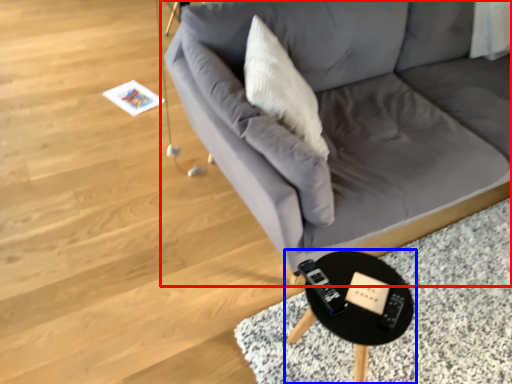
Question: Which object appears closest to the camera in this image, studio couch (highlighted by a red box) or table (highlighted by a blue box)?

Choices:
 (A) studio couch
 (B) table

Answer: (A)